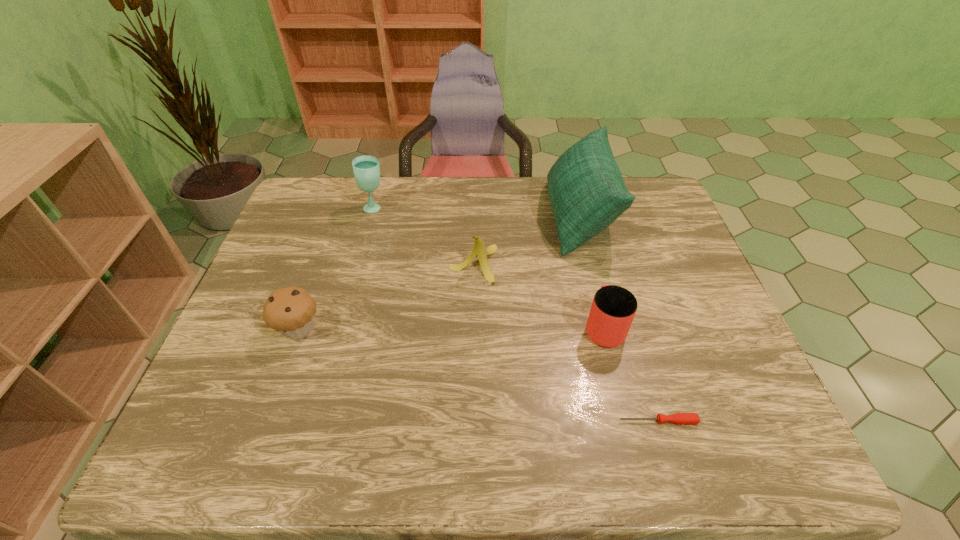
Find the location of `the tallest object`. the tallest object is located at coordinates (586, 190).

You are a GUI agent. You are given a task and a screenshot of the screen. Output one action in this format:
    pyautogui.click(x=<x>, y=<y>)
    Task: Click on the second tallest object
    This screenshot has width=960, height=540.
    Given the screenshot: What is the action you would take?
    pyautogui.click(x=366, y=169)

Where is `glass`? The image size is (960, 540). glass is located at coordinates (366, 169).

Locate an element on the screen. The width and height of the screenshot is (960, 540). banana is located at coordinates (479, 250).

This screenshot has width=960, height=540. Identify the location of cup. (613, 308).

The image size is (960, 540). Find the location of `the leftmost object`. the leftmost object is located at coordinates (290, 311).

Identify the location of the shortest object. (679, 418).

Locate an element on the screen. the nearest object is located at coordinates (679, 418).

Where is `vacant area located on the front-facing side of the cushion`? vacant area located on the front-facing side of the cushion is located at coordinates (442, 217).

What are the coordinates of `blank space located on the front-facing side of the cushion` in the screenshot? It's located at (501, 217).